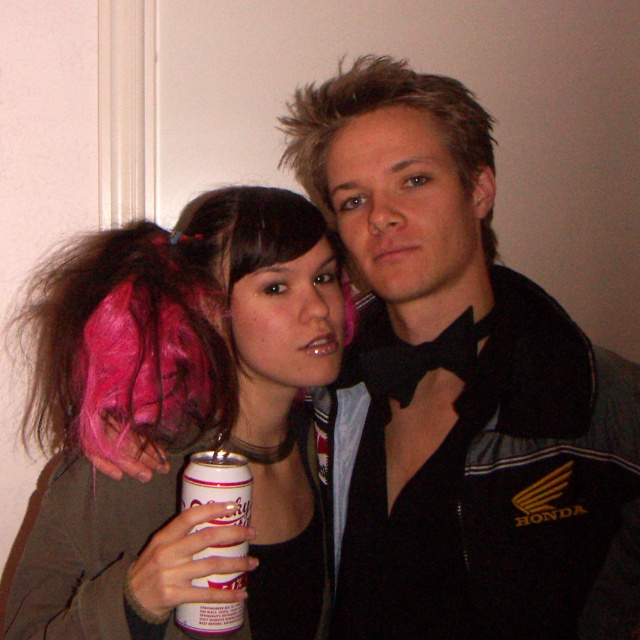
Is black fabric bow tie at center above white matte can at center?

Indeed, black fabric bow tie at center is positioned over white matte can at center.

Between black fabric bow tie at center and white matte can at center, which one has less height?

Standing shorter between the two is white matte can at center.

Who is more forward, (493, 396) or (234, 508)?

Positioned in front is point (234, 508).

You are a GUI agent. You are given a task and a screenshot of the screen. Output one action in this format:
    pyautogui.click(x=<x>, y=<y>)
    Task: Click on the black fabric bow tie at center
    This screenshot has height=640, width=640.
    Given the screenshot: What is the action you would take?
    pyautogui.click(x=460, y=385)

Can you confirm if black fabric bow tie at center is positioned above pink fabric wig at upper left?

Correct, black fabric bow tie at center is located above pink fabric wig at upper left.

Is black fabric bow tie at center positioned in front of pink fabric wig at upper left?

No, black fabric bow tie at center is further to the viewer.

Is point (467, 442) less distant than point (189, 429)?

Yes, point (467, 442) is in front of point (189, 429).

The image size is (640, 640). Find the location of `black fabric bow tie at center`. black fabric bow tie at center is located at coordinates (460, 385).

Is point (211, 252) positioned behind point (193, 580)?

Yes, it is.

Is pink fabric wig at left above white matte can at center?

Correct, pink fabric wig at left is located above white matte can at center.

Describe the element at coordinates (125, 340) in the screenshot. I see `pink fabric wig at left` at that location.

Locate an element on the screen. pink fabric wig at left is located at coordinates (125, 340).